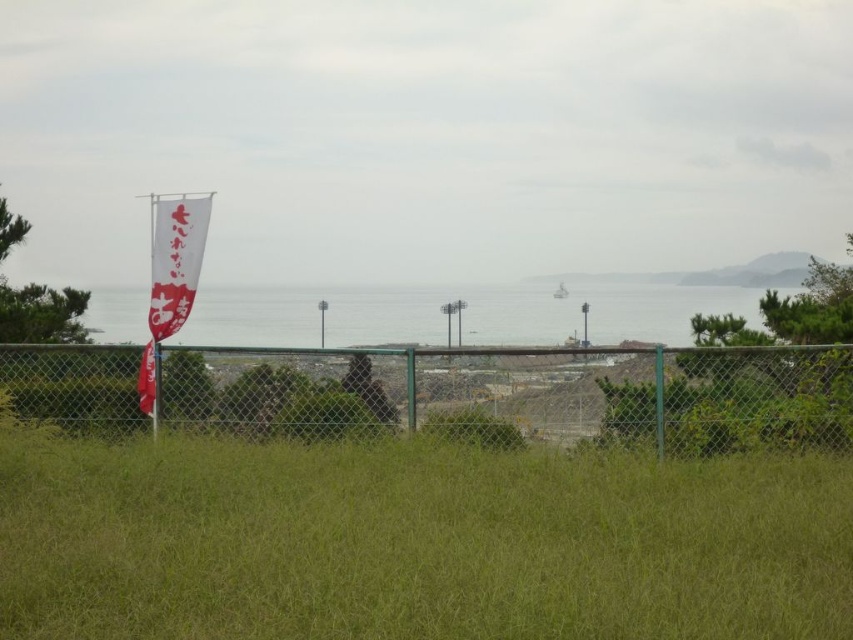
You are a gardener who needs to place a 3 meter long fence between the green grass at center and the white paper flag at left. Is there enough space to place the fence between them?

The distance between the green grass at center and the white paper flag at left is 2.67 meters. Since the fence is 3 meters long, it would not fit in the available space.